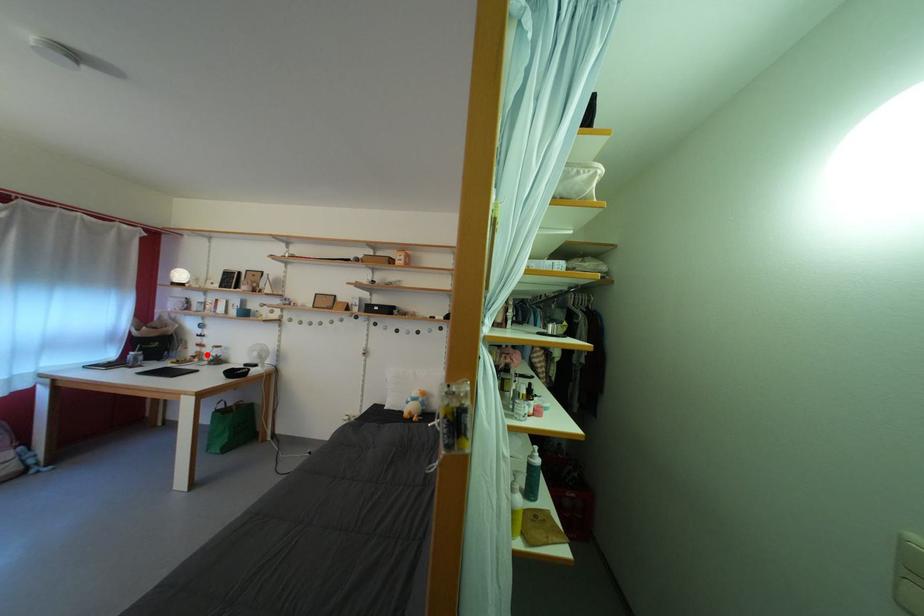
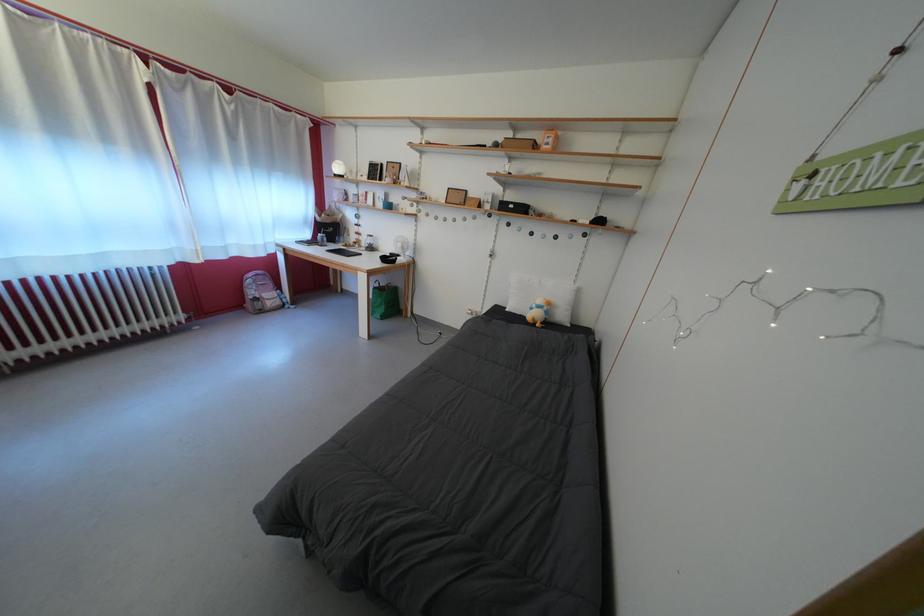
Question: I am providing you with two images of the same scene from different viewpoints. In image1, a red point is highlighted. Considering the same 3D point in image2, which of the following is correct?

Choices:
 (A) It is closer
 (B) It is farther

Answer: (A)